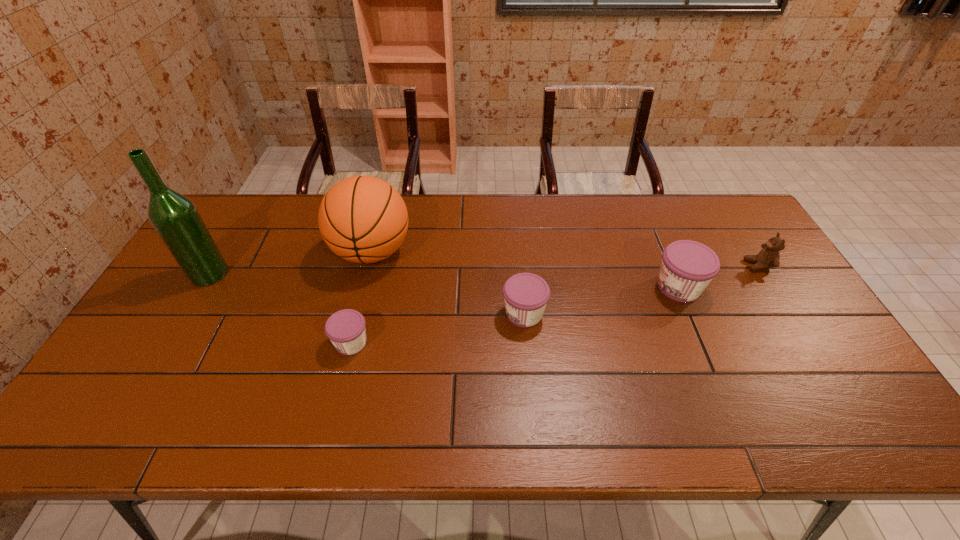
The jams are evenly distributed in the image. To maintain this, where would you place another jam on the left? Please point to a free space. Please provide its 2D coordinates. Your answer should be formatted as a tuple, i.e. [(x, y)], where the tuple contains the x and y coordinates of a point satisfying the conditions above.

[(156, 376)]